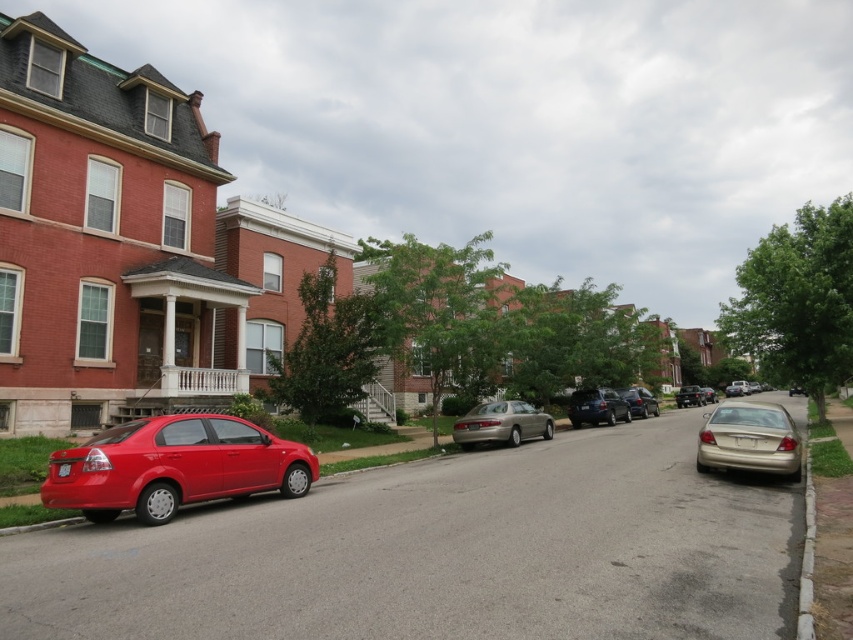
You are a delivery driver who needs to park your truck next to the white concrete curb at lower right. The truck is as wide as the matte black sedan at center. Will the truck fit next to the curb?

The white concrete curb at lower right is thinner than the matte black sedan at center. Since the truck is as wide as the matte black sedan at center, the truck will not fit next to the curb because the curb is narrower than the truck.

You are driving a truck that is 2 meters wide and need to park it on the residential street. You see the matte red sedan at lower left and the gold metallic sedan at center. Which parking spot between these two cars can accommodate your truck?

The matte red sedan at lower left has a greater width than the gold metallic sedan at center. Since your truck is 2 meters wide, you should choose the parking spot between the gold metallic sedan at center and the next available space, as it might provide sufficient width for your truck.

Consider the image. You are standing at the starting point of the street and want to reach the end of the street. Which of the two points, point (x=471, y=424) or point (x=811, y=536), is closer to the end of the street?

Point (x=471, y=424) is behind point (x=811, y=536), so point (x=471, y=424) is closer to the end of the street.